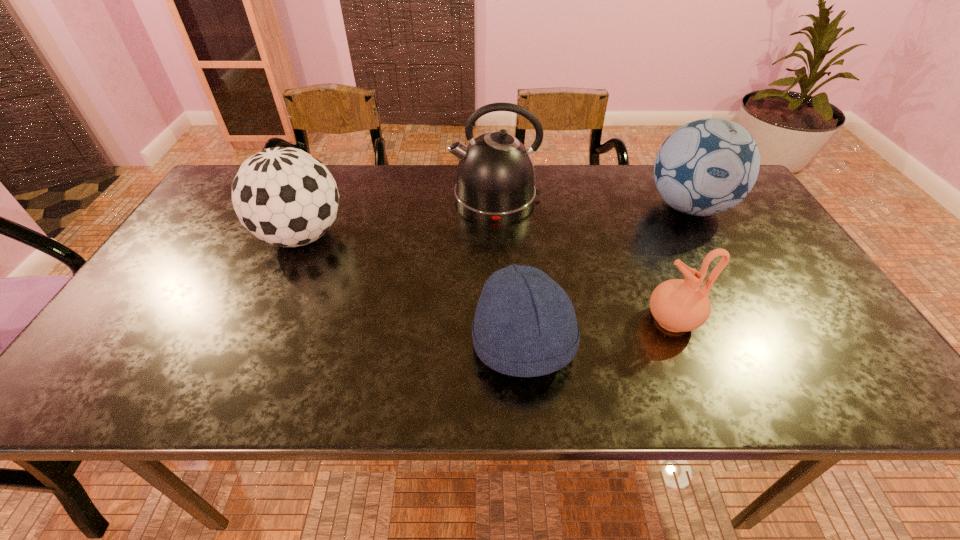
What are the coordinates of `free space at the near edge` in the screenshot? It's located at (676, 383).

The image size is (960, 540). In the image, there is a desktop. Find the location of `vacant space at the left edge`. vacant space at the left edge is located at coordinates click(202, 210).

What are the coordinates of `vacant space at the right edge of the desktop` in the screenshot? It's located at (762, 296).

In order to click on vacant space at the near right corner in this screenshot , I will do `click(837, 369)`.

Locate an element on the screen. This screenshot has width=960, height=540. vacant point located between the kettle and the left soccer ball is located at coordinates (398, 217).

What are the coordinates of `empty space that is in between the leftmost object and the kettle` in the screenshot? It's located at (398, 217).

This screenshot has height=540, width=960. I want to click on free area in between the pottery and the skullcap, so click(x=598, y=332).

Where is `unoccupied area between the shortest object and the right soccer ball`? unoccupied area between the shortest object and the right soccer ball is located at coordinates pos(606,275).

This screenshot has width=960, height=540. In order to click on free area in between the right soccer ball and the left soccer ball in this screenshot , I will do `click(495, 222)`.

The image size is (960, 540). What are the coordinates of `vacant region between the pottery and the leftmost object` in the screenshot? It's located at (487, 278).